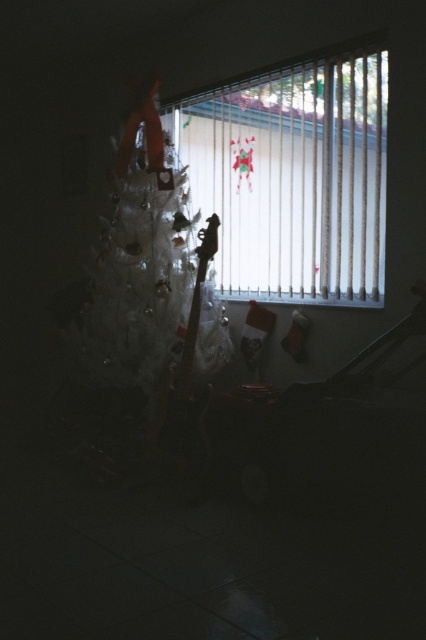
Question: Does white plastic blinds at upper right appear on the right side of white frosted christmas tree at center?

Choices:
 (A) yes
 (B) no

Answer: (A)

Question: Does white plastic blinds at upper right appear under white frosted christmas tree at center?

Choices:
 (A) yes
 (B) no

Answer: (B)

Question: Which object is farther from the camera taking this photo?

Choices:
 (A) white plastic blinds at upper right
 (B) white frosted christmas tree at center

Answer: (B)

Question: Which of the following is the farthest from the observer?

Choices:
 (A) white frosted christmas tree at center
 (B) white plastic blinds at upper right

Answer: (A)

Question: Is white plastic blinds at upper right above white frosted christmas tree at center?

Choices:
 (A) yes
 (B) no

Answer: (A)